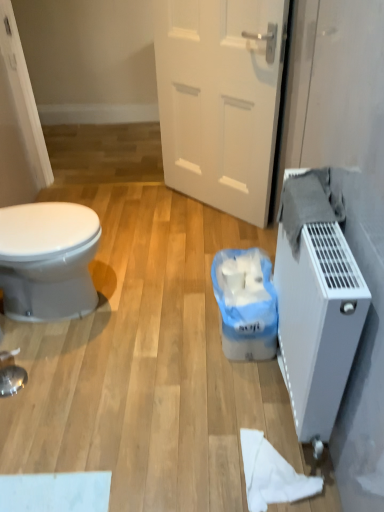
Find the location of `vacant area that lies between white plastic radiator at right and white matte toilet paper at lower right`. vacant area that lies between white plastic radiator at right and white matte toilet paper at lower right is located at coordinates (259, 404).